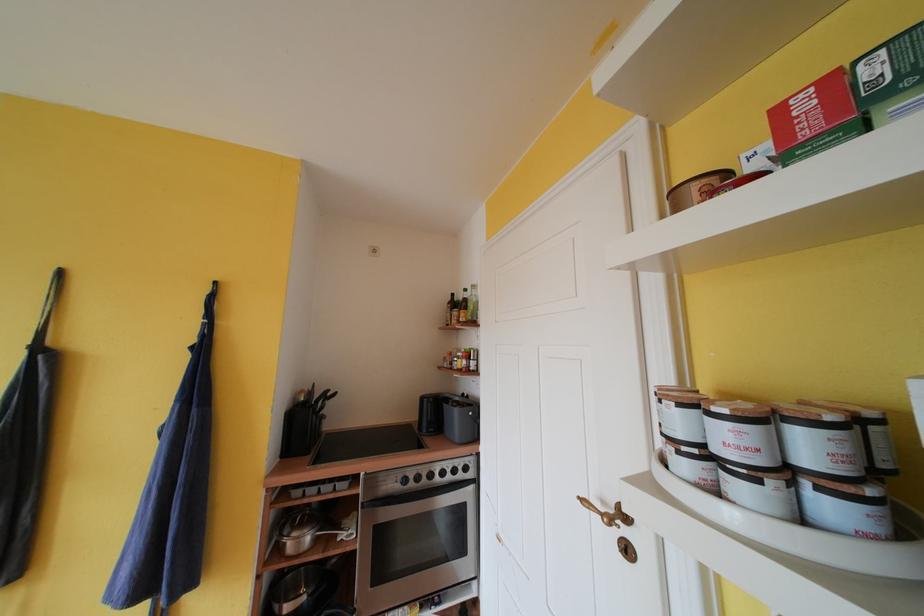
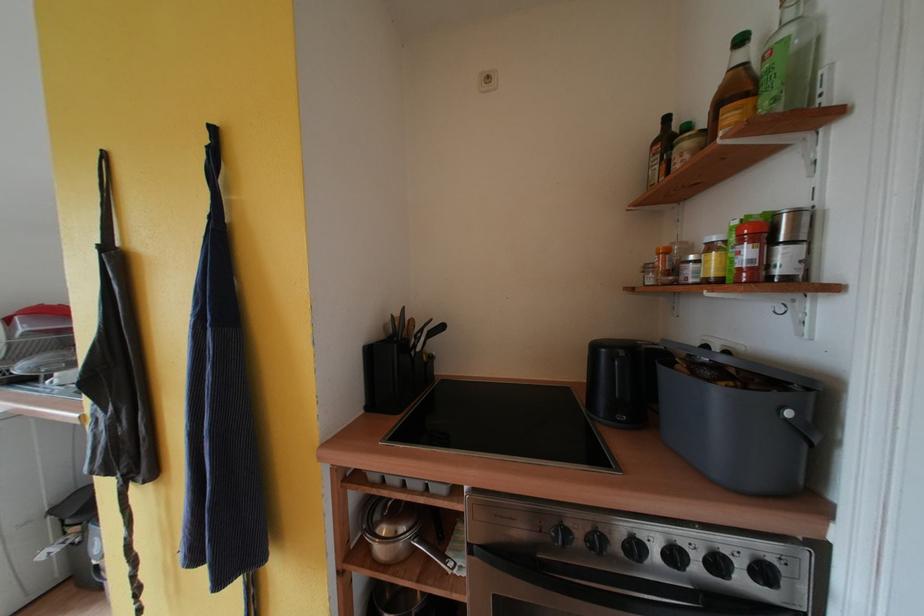
Find the pixel in the second image that matches point 471,472 in the first image.

(771, 577)